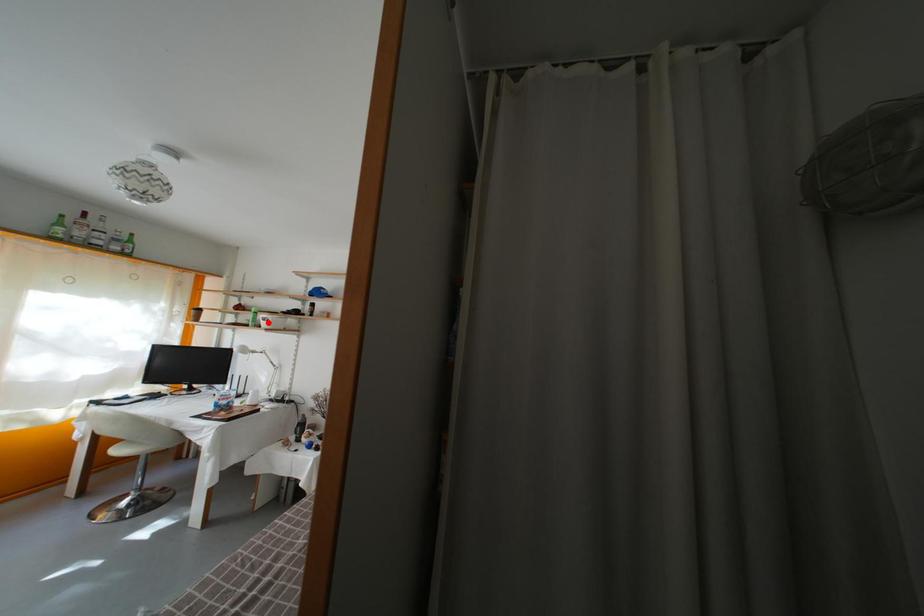
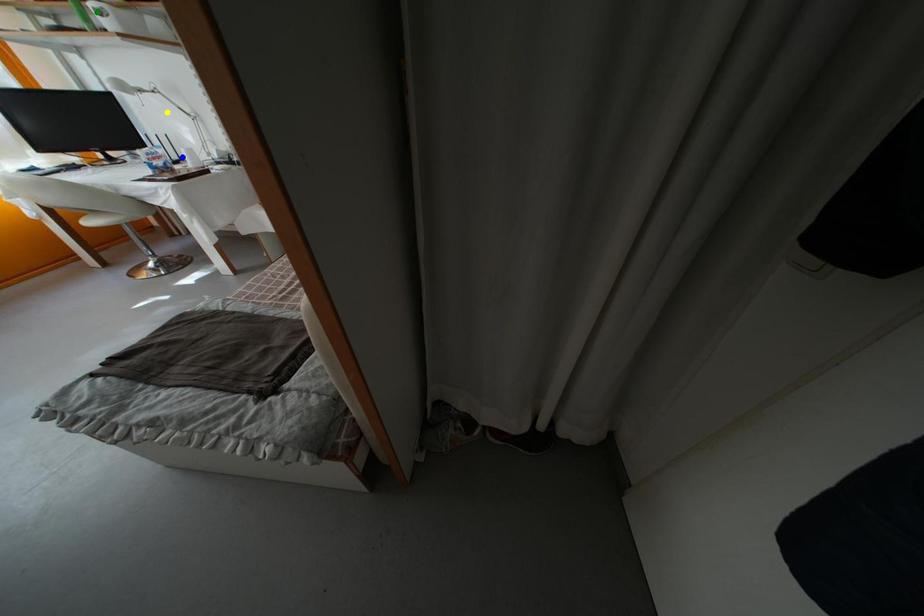
Question: I am providing you with two images of the same scene from different viewpoints. A red point is marked on the first image. You are given multiple points on the second image. Which mark in image 2 goes with the point in image 1?

Choices:
 (A) green point
 (B) yellow point
 (C) blue point

Answer: (A)